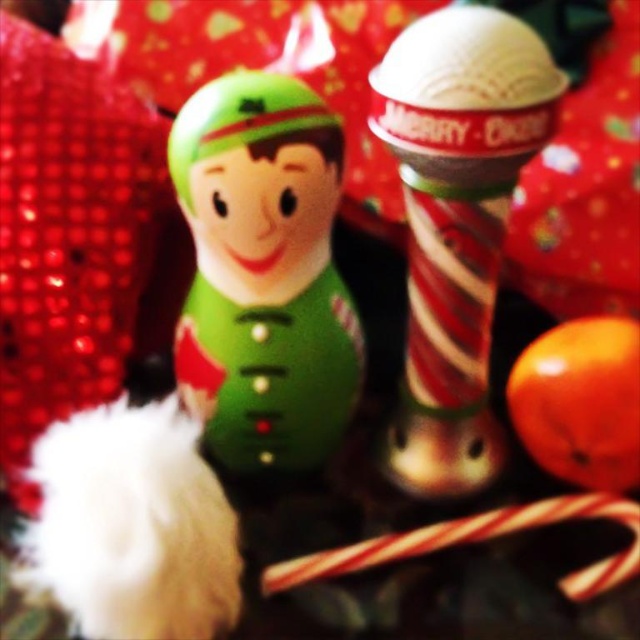
You are setting up a Christmas display and want to place the matte green plush at center and the shiny red and white striped candy cane at center closer together. Currently, they are 4.33 inches apart. If you move them each 1 inch towards each other, will they be within 2 inches of each other?

After moving each object 1 inch closer, the distance between the matte green plush at center and the shiny red and white striped candy cane at center becomes 4.33 inches minus 2 inches, which equals 2.33 inches. Since 2.33 inches is greater than 2 inches, they will not be within 2 inches of each other.

You are setting up a Christmas display and want to place both the shiny red and white striped candy cane at center and the white striped candy cane at lower center into a narrow decorative stand that can only hold items up to 2 cm in thickness. Which candy cane might not fit into the stand?

The white striped candy cane at lower center might not fit into the stand because it is thicker than the shiny red and white striped candy cane at center, which is thinner and may meet the 2 cm thickness requirement.